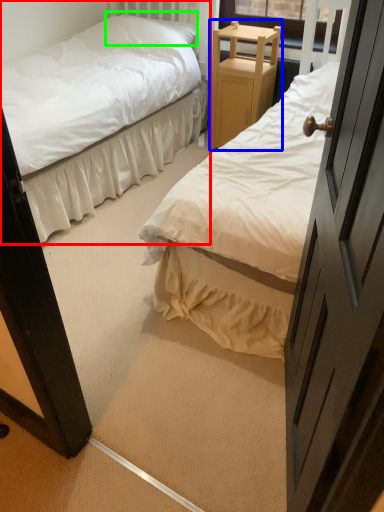
Question: Which is nearer to the bed (highlighted by a red box)? furniture (highlighted by a blue box) or pillow (highlighted by a green box).

Choices:
 (A) furniture
 (B) pillow

Answer: (A)